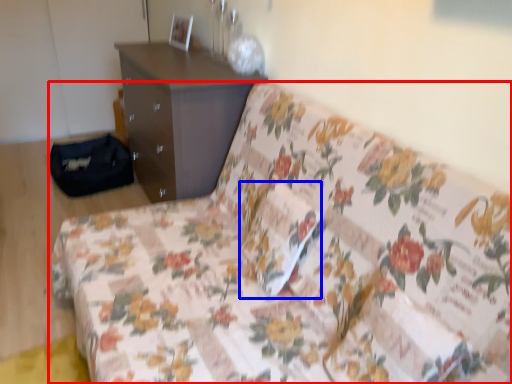
Question: Which object is further to the camera taking this photo, studio couch (highlighted by a red box) or pillow (highlighted by a blue box)?

Choices:
 (A) studio couch
 (B) pillow

Answer: (B)